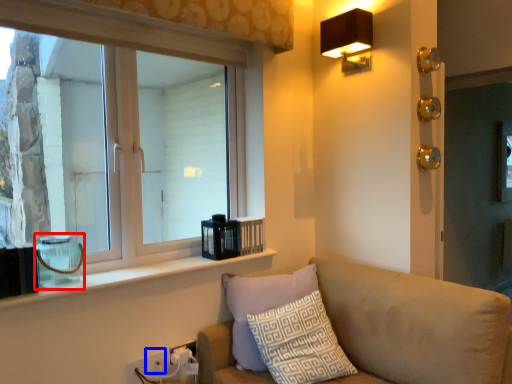
Question: Among these objects, which one is farthest to the camera, glass vase (highlighted by a red box) or electric outlet (highlighted by a blue box)?

Choices:
 (A) glass vase
 (B) electric outlet

Answer: (B)